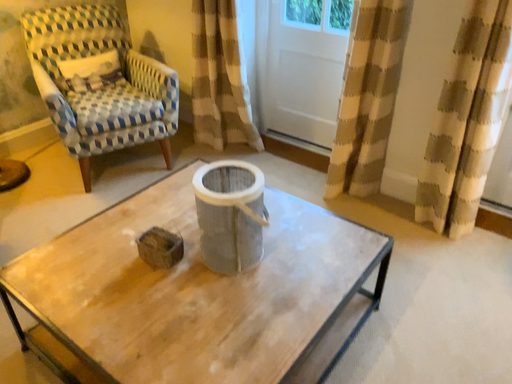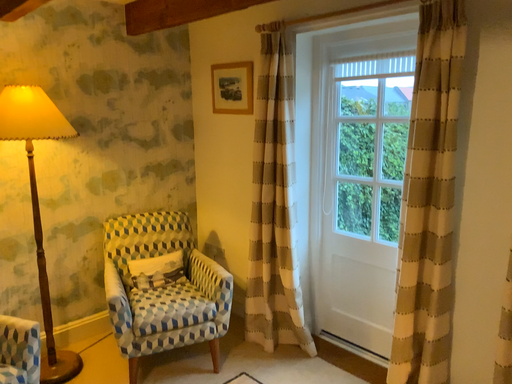
Question: How did the camera likely rotate when shooting the video?

Choices:
 (A) rotated right
 (B) rotated left

Answer: (B)